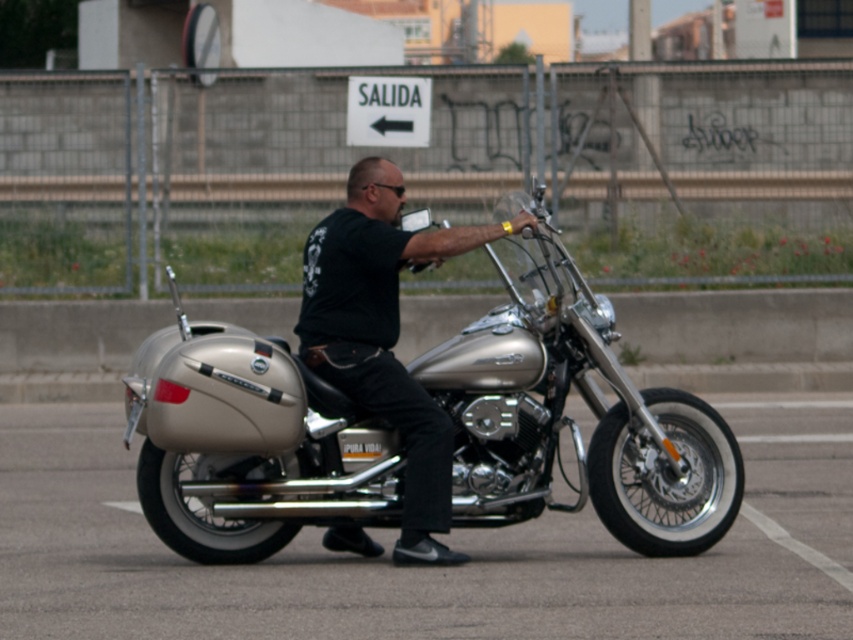
Consider the image. Who is higher up, silver metallic motorcycle at center or black matte shirt at center?

black matte shirt at center is higher up.

Does silver metallic motorcycle at center appear under black matte shirt at center?

Correct, silver metallic motorcycle at center is located below black matte shirt at center.

Find the location of a particular element. silver metallic motorcycle at center is located at coordinates (572, 420).

Where is `silver metallic motorcycle at center`? silver metallic motorcycle at center is located at coordinates (572, 420).

Is metallic silver motorcycle at center positioned at the back of black matte shirt at center?

No, it is not.

Is point (242, 612) positioned after point (451, 252)?

No, (242, 612) is in front of (451, 252).

Measure the distance between metallic silver motorcycle at center and camera.

8.85 meters

This screenshot has height=640, width=853. In order to click on metallic silver motorcycle at center in this screenshot , I will do point(426,568).

Is metallic silver motorcycle at center to the right of silver metallic motorcycle at center from the viewer's perspective?

Correct, you'll find metallic silver motorcycle at center to the right of silver metallic motorcycle at center.

Identify the location of metallic silver motorcycle at center. (426, 568).